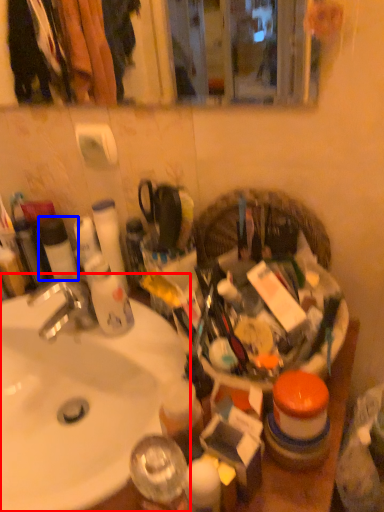
Question: Which of the following is the closest to the observer, sink (highlighted by a red box) or toiletry (highlighted by a blue box)?

Choices:
 (A) sink
 (B) toiletry

Answer: (A)